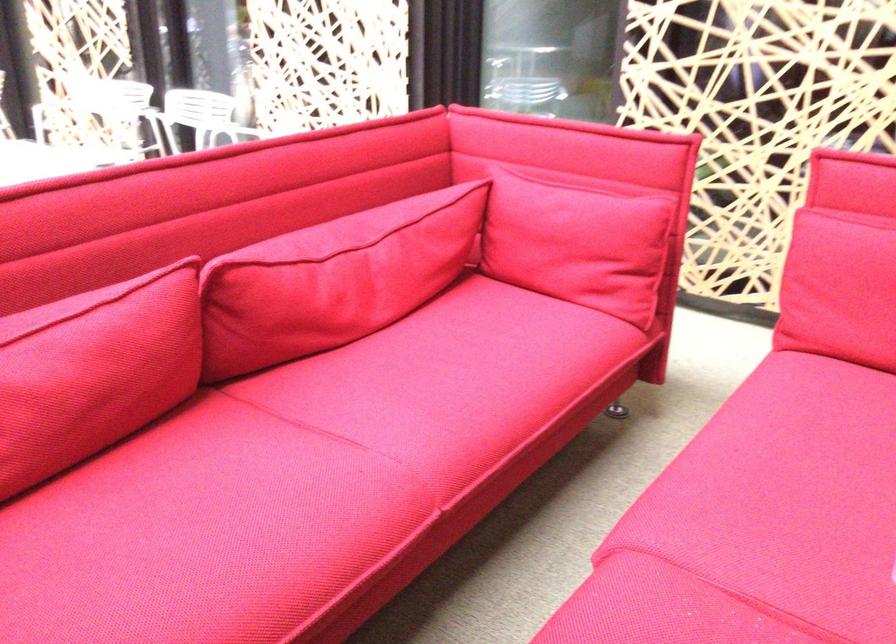
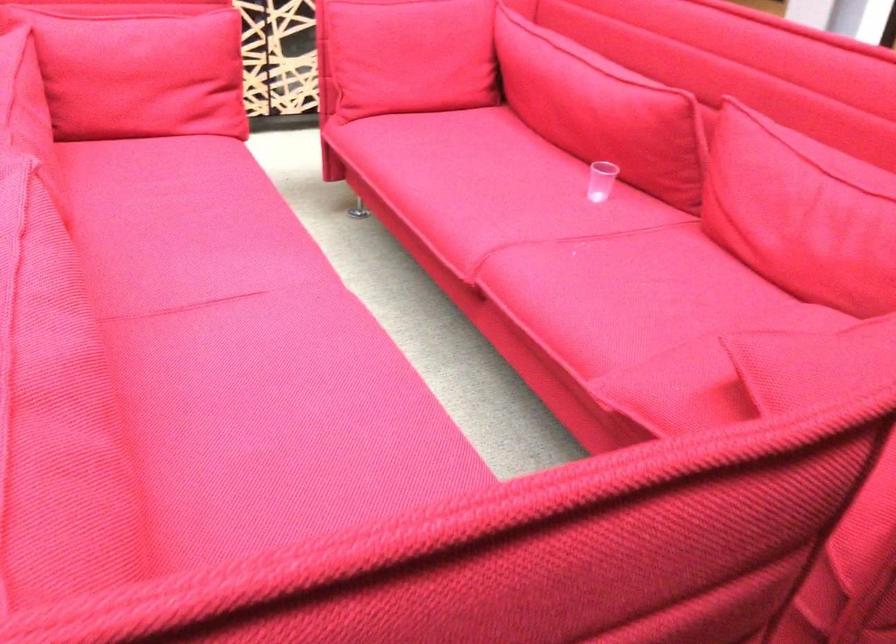
Locate, in the second image, the point that corresponds to (x=272, y=464) in the first image.

(243, 337)